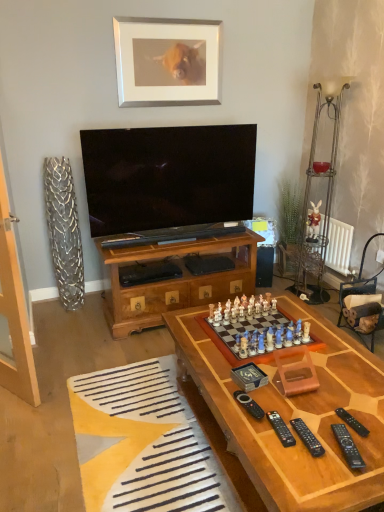
Locate an element on the screen. Image resolution: width=384 pixels, height=512 pixels. free space above yellow fabric rug at lower left (from a real-world perspective) is located at coordinates (143, 429).